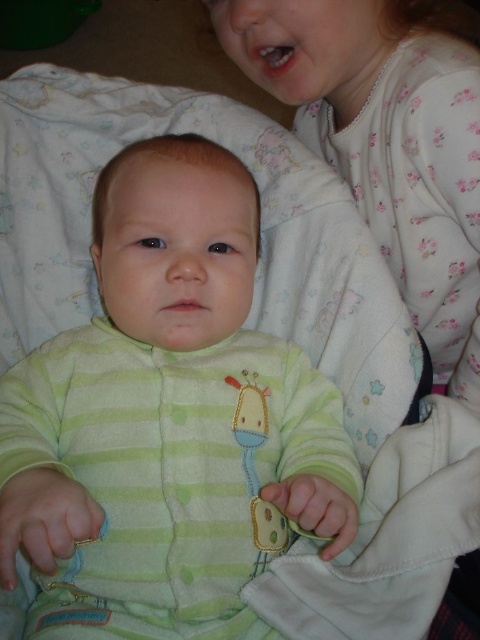
Question: Can you confirm if green striped onesie at center is smaller than white floral pajamas at upper right?

Choices:
 (A) no
 (B) yes

Answer: (A)

Question: Does green striped onesie at center have a larger size compared to white floral pajamas at upper right?

Choices:
 (A) no
 (B) yes

Answer: (B)

Question: Which object appears farthest from the camera in this image?

Choices:
 (A) white floral pajamas at upper right
 (B) green striped onesie at center

Answer: (A)

Question: Among these objects, which one is nearest to the camera?

Choices:
 (A) white floral pajamas at upper right
 (B) green striped onesie at center

Answer: (B)

Question: Considering the relative positions of green striped onesie at center and white floral pajamas at upper right in the image provided, where is green striped onesie at center located with respect to white floral pajamas at upper right?

Choices:
 (A) below
 (B) above

Answer: (A)